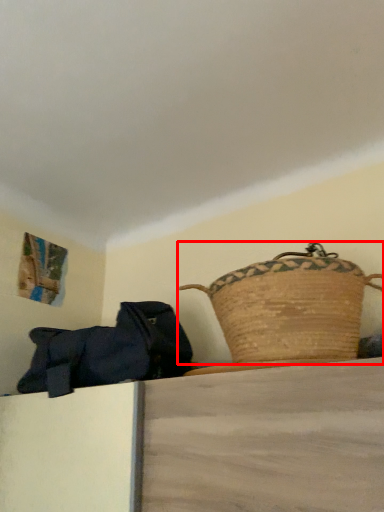
Question: From the image's perspective, considering the relative positions of picnic basket (annotated by the red box) and handbag in the image provided, where is picnic basket (annotated by the red box) located with respect to the staircase?

Choices:
 (A) above
 (B) below

Answer: (A)